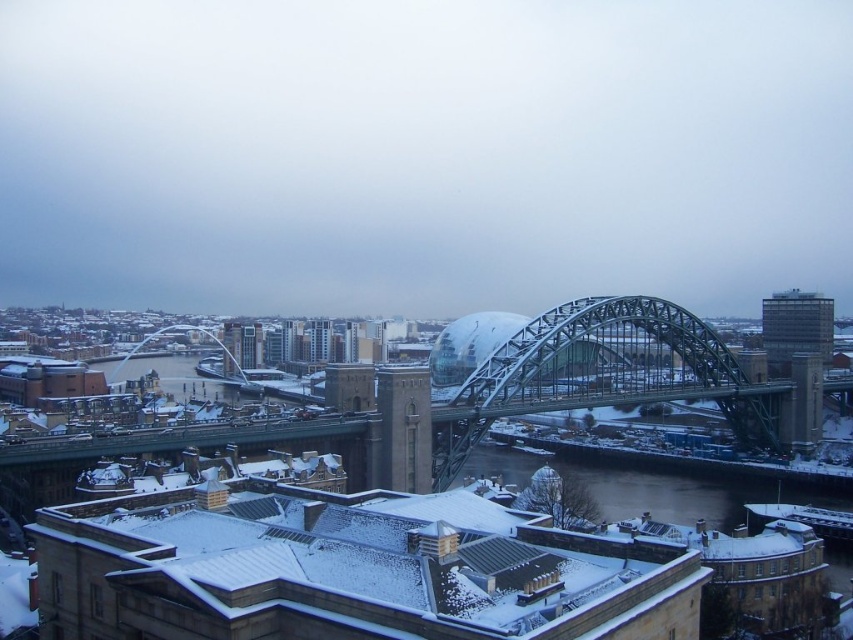
Is point (555, 397) behind point (828, 330)?

No.

Is the position of metallic steel bridge at center more distant than that of glassy reflective building at upper right?

No, it is not.

The image size is (853, 640). Identify the location of metallic steel bridge at center. (601, 372).

The image size is (853, 640). I want to click on metallic steel bridge at center, so click(601, 372).